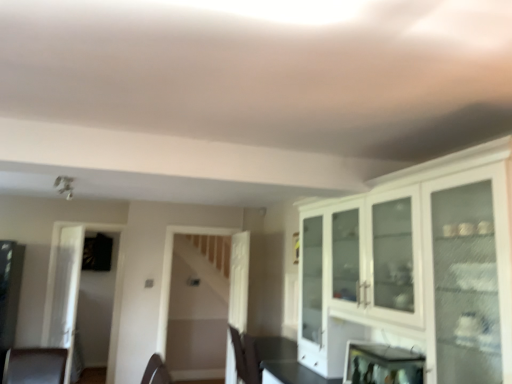
Question: Does transparent glass door at left have a greater width compared to metallic reflective mirror at lower right?

Choices:
 (A) yes
 (B) no

Answer: (B)

Question: Is transparent glass door at left further to camera compared to metallic reflective mirror at lower right?

Choices:
 (A) yes
 (B) no

Answer: (A)

Question: Is transparent glass door at left shorter than metallic reflective mirror at lower right?

Choices:
 (A) no
 (B) yes

Answer: (A)

Question: Is transparent glass door at left facing towards metallic reflective mirror at lower right?

Choices:
 (A) yes
 (B) no

Answer: (B)

Question: From the image's perspective, is transparent glass door at left beneath metallic reflective mirror at lower right?

Choices:
 (A) yes
 (B) no

Answer: (A)

Question: Considering the relative sizes of transparent glass door at left and metallic reflective mirror at lower right in the image provided, is transparent glass door at left smaller than metallic reflective mirror at lower right?

Choices:
 (A) no
 (B) yes

Answer: (A)

Question: From a real-world perspective, is transparent glass door at left over brown leather chair at lower left?

Choices:
 (A) yes
 (B) no

Answer: (A)

Question: Considering the relative sizes of transparent glass door at left and brown leather chair at lower left in the image provided, is transparent glass door at left smaller than brown leather chair at lower left?

Choices:
 (A) no
 (B) yes

Answer: (B)

Question: Would you say transparent glass door at left is a long distance from brown leather chair at lower left?

Choices:
 (A) no
 (B) yes

Answer: (B)

Question: From a real-world perspective, does transparent glass door at left sit lower than brown leather chair at lower left?

Choices:
 (A) no
 (B) yes

Answer: (A)

Question: Is transparent glass door at left not inside brown leather chair at lower left?

Choices:
 (A) yes
 (B) no

Answer: (A)

Question: Can you see transparent glass door at left touching brown leather chair at lower left?

Choices:
 (A) yes
 (B) no

Answer: (B)

Question: Can white glossy cabinet at upper right be found inside metallic reflective mirror at lower right?

Choices:
 (A) yes
 (B) no

Answer: (B)